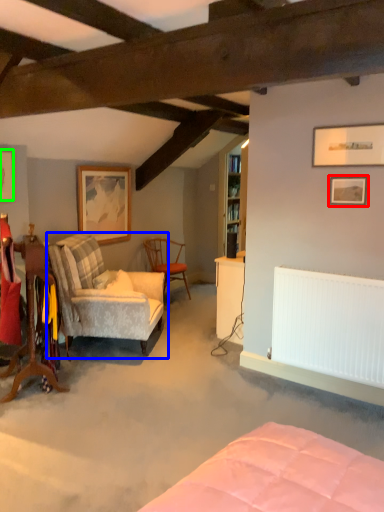
Question: Based on their relative distances, which object is nearer to picture frame (highlighted by a red box)? Choose from chair (highlighted by a blue box) and picture frame (highlighted by a green box).

Choices:
 (A) chair
 (B) picture frame

Answer: (A)